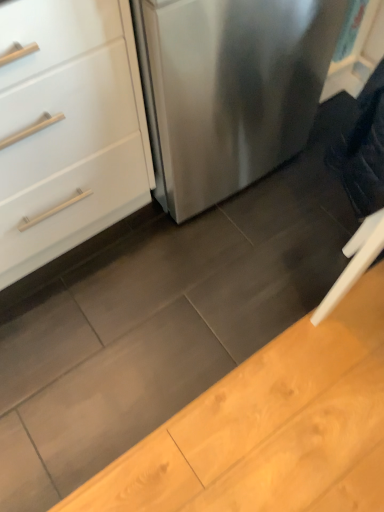
Identify the location of free space in front of stainless steel refrigerator at left. (206, 281).